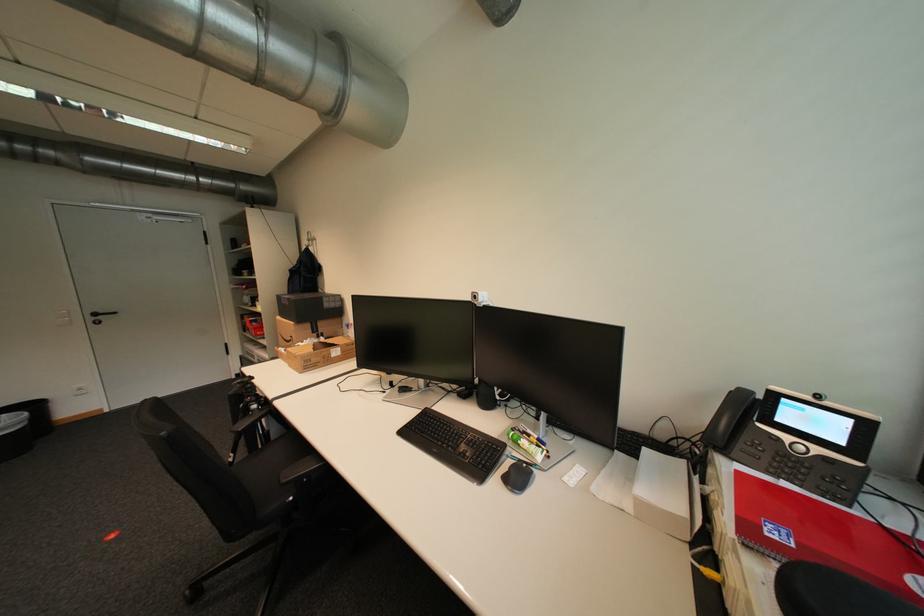
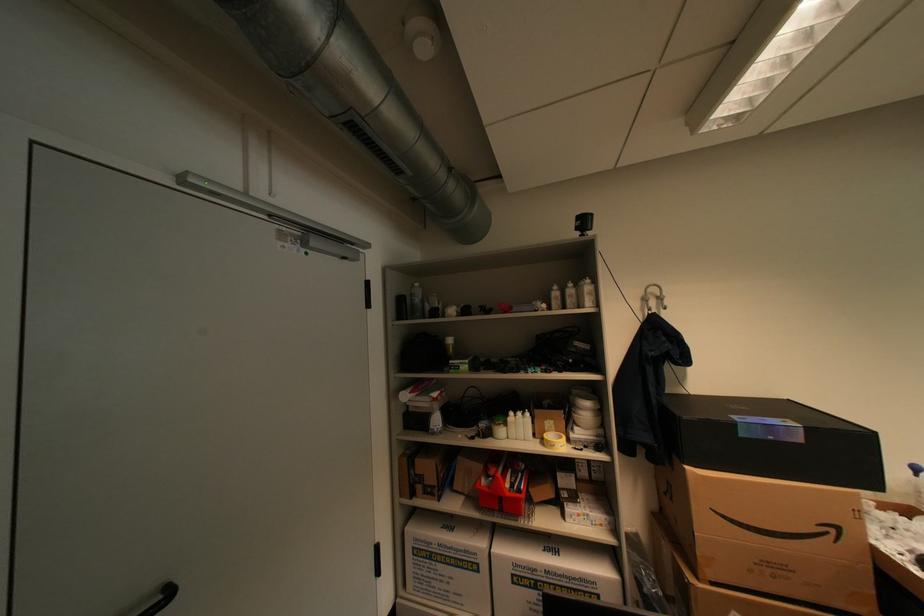
Find the pixel in the second image that matches (x=123, y=314) in the first image.

(176, 594)